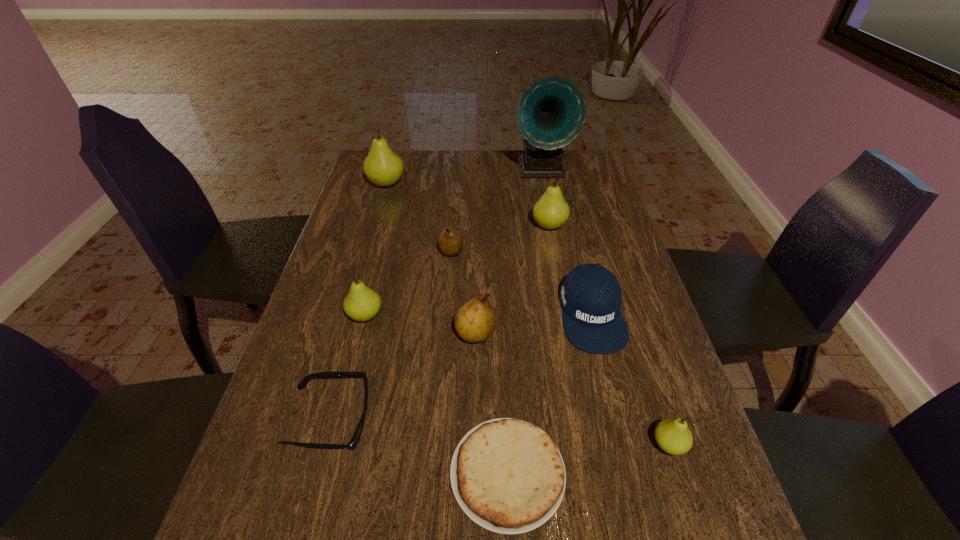
Identify the location of empty space that is in between the second nearest green pear and the beige tortilla. (437, 395).

Locate an element on the screen. The height and width of the screenshot is (540, 960). empty space between the blue baseball cap and the third tallest object is located at coordinates (570, 270).

Find the location of a particular element. The height and width of the screenshot is (540, 960). free spot between the seventh nearest object and the tallest pear is located at coordinates (419, 218).

This screenshot has height=540, width=960. What are the coordinates of `free space between the sunglasses and the tortilla` in the screenshot? It's located at (420, 447).

Where is `free space between the tortilla and the blue baseball cap`? This screenshot has width=960, height=540. free space between the tortilla and the blue baseball cap is located at coordinates (550, 394).

This screenshot has height=540, width=960. I want to click on object that is the third nearest to the sunglasses, so click(475, 321).

Locate an element on the screen. The height and width of the screenshot is (540, 960). object that stands as the sixth closest to the fifth nearest pear is located at coordinates (362, 303).

Identify which pear is located as the fifth nearest to the second biggest green pear. Please provide its 2D coordinates. Your answer should be formatted as a tuple, i.e. [(x, y)], where the tuple contains the x and y coordinates of a point satisfying the conditions above.

[(673, 436)]

Point out which pear is positioned as the second nearest to the nearest pear. Please provide its 2D coordinates. Your answer should be formatted as a tuple, i.e. [(x, y)], where the tuple contains the x and y coordinates of a point satisfying the conditions above.

[(551, 211)]

Locate an element on the screen. This screenshot has height=540, width=960. green pear that is the third closest to the tallest object is located at coordinates (362, 303).